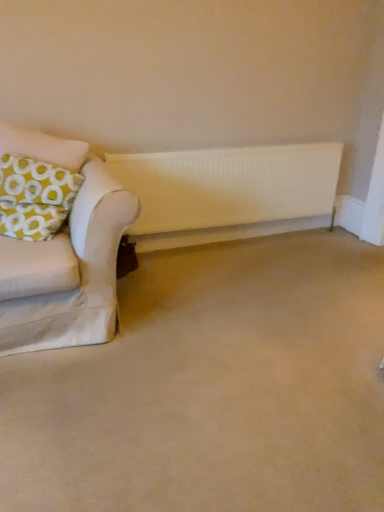
Question: In terms of size, does beige carpet at lower center appear bigger or smaller than white matte radiator at center?

Choices:
 (A) big
 (B) small

Answer: (A)

Question: From the image's perspective, is beige carpet at lower center above or below white matte radiator at center?

Choices:
 (A) below
 (B) above

Answer: (A)

Question: Which is nearer to the white matte radiator at center?

Choices:
 (A) beige carpet at lower center
 (B) yellow-green fabric pillow at left

Answer: (B)

Question: Based on their relative distances, which object is farther from the white matte radiator at center?

Choices:
 (A) yellow-green fabric pillow at left
 (B) beige carpet at lower center

Answer: (B)